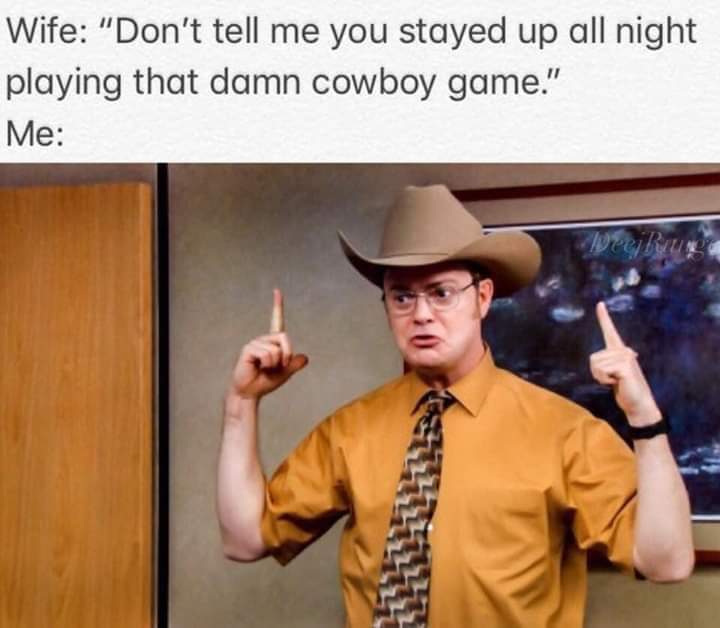
Find the location of `picture frame`. picture frame is located at coordinates (629, 186).